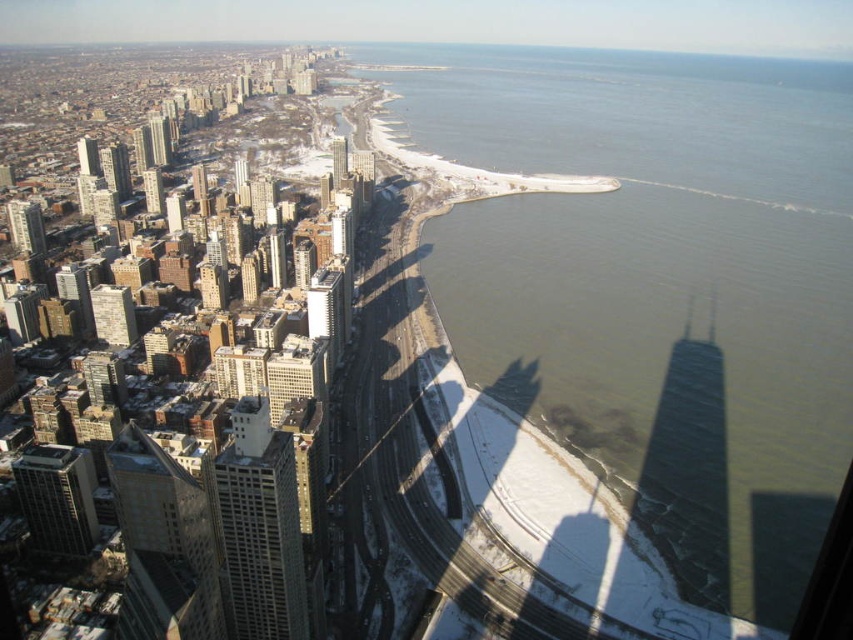
You are a drone operator who needs to fly a drone from the gray concrete building at lower left to the matte glass skyscraper at center. Considering their heights, which building will cast a longer shadow on the ground?

The gray concrete building at lower left is much taller than the matte glass skyscraper at center, so it will cast a longer shadow on the ground.

You are a drone operator flying over the city. You need to navigate between two points marked in the scene. The first point is at coordinates point (556, 410) and the second is at point (346, 145). From the perspective of someone looking at the city from above, which point is closer to the observer?

Point (556, 410) is in front of point (346, 145), so it is closer to the observer.